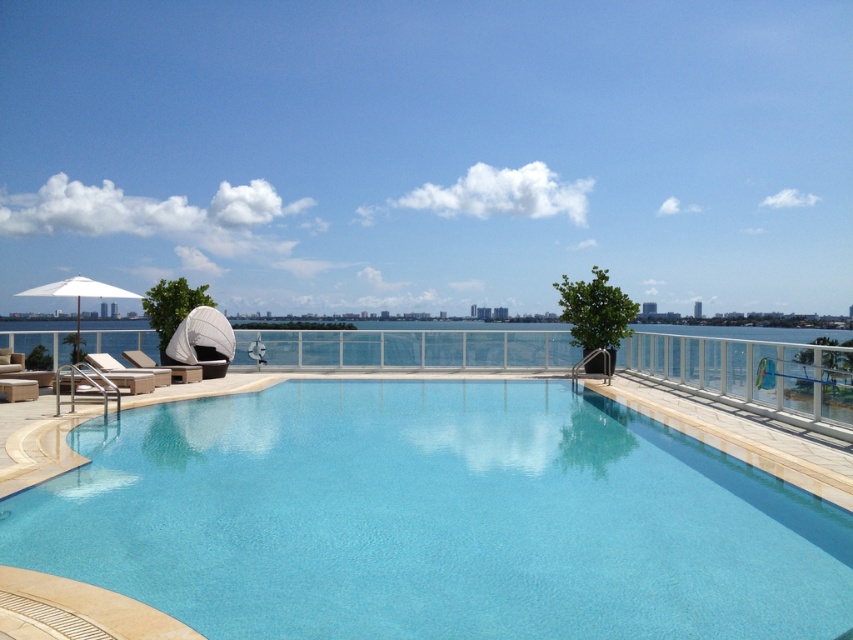
Identify the location of white fabric umbrella at upper left. (78, 292).

How far apart are white fabric umbrella at upper left and white fabric lounge chair at left?

They are 8.48 feet apart.

Does point (39, 289) come in front of point (155, 369)?

Yes, point (39, 289) is closer to viewer.

I want to click on white fabric umbrella at upper left, so click(x=78, y=292).

Can you confirm if beige fabric lounge chair at left is wider than white fabric lounge chair at left?

Indeed, beige fabric lounge chair at left has a greater width compared to white fabric lounge chair at left.

Can you confirm if beige fabric lounge chair at left is thinner than white fabric lounge chair at left?

No.

This screenshot has width=853, height=640. What are the coordinates of `beige fabric lounge chair at left` in the screenshot? It's located at (128, 372).

Does white fabric umbrella at upper left appear over beige fabric lounge chair at left?

Yes, white fabric umbrella at upper left is above beige fabric lounge chair at left.

Is point (47, 291) positioned after point (120, 381)?

Yes, it is behind point (120, 381).

Is point (100, 285) behind point (138, 376)?

Yes, point (100, 285) is behind point (138, 376).

The image size is (853, 640). Identify the location of white fabric umbrella at upper left. (78, 292).